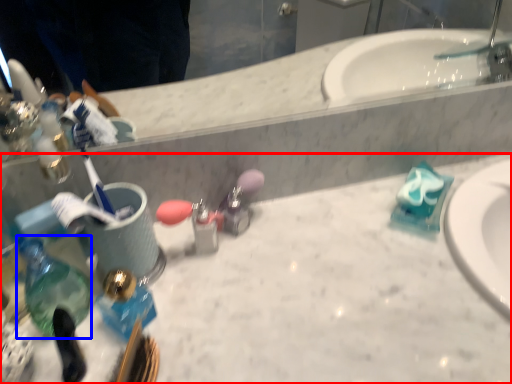
Question: Which of the following is the farthest to the observer, counter top (highlighted by a red box) or bottle (highlighted by a blue box)?

Choices:
 (A) counter top
 (B) bottle

Answer: (B)